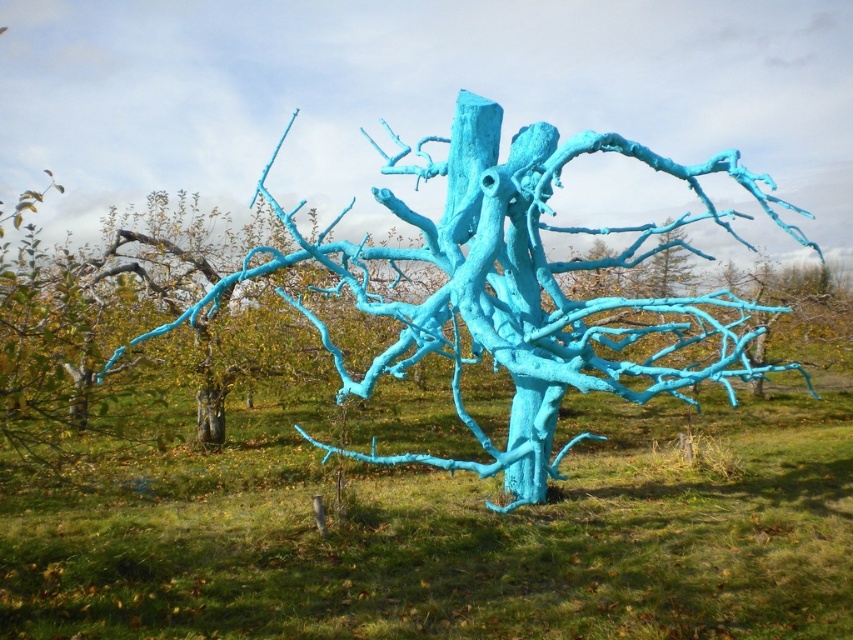
Does point (404, 529) come behind point (606, 333)?

No, it is not.

Locate an element on the screen. Image resolution: width=853 pixels, height=640 pixels. matte blue tree at center is located at coordinates (453, 534).

Does point (247, 477) come closer to viewer compared to point (471, 284)?

No, (247, 477) is behind (471, 284).

What are the coordinates of `matte blue tree at center` in the screenshot? It's located at tap(453, 534).